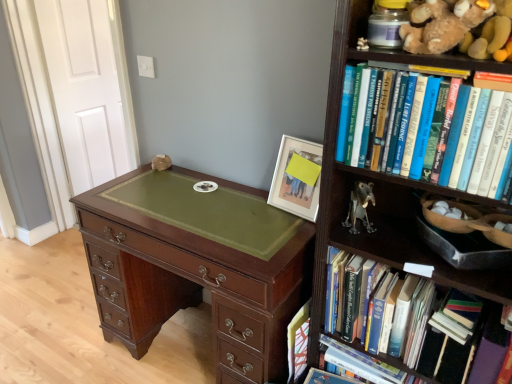
Question: From the image's perspective, is hardcover book at center, arranged as the third book when viewed from the top, located above or below matte wooden picture frame at upper center?

Choices:
 (A) below
 (B) above

Answer: (A)

Question: Is hardcover book at center, the first book when ordered from bottom to top, to the left or to the right of matte wooden picture frame at upper center in the image?

Choices:
 (A) right
 (B) left

Answer: (A)

Question: Estimate the real-world distances between objects in this image. Which object is closer to the hardcover book at center right, placed as the first book when sorted from top to bottom?

Choices:
 (A) mahogany wood chest of drawers at center
 (B) dark wood bookcase at right
 (C) metallic gray figurine at center-right
 (D) matte wooden picture frame at upper center
 (E) hardcover books at right, acting as the second book starting from the bottom

Answer: (B)

Question: Which of these objects is positioned farthest from the mahogany wood chest of drawers at center?

Choices:
 (A) soft brown plush at upper right
 (B) dark wood bookcase at right
 (C) metallic gray figurine at center-right
 (D) hardcover book at center right, the third book ordered from the bottom
 (E) hardcover books at right, acting as the second book starting from the bottom

Answer: (A)